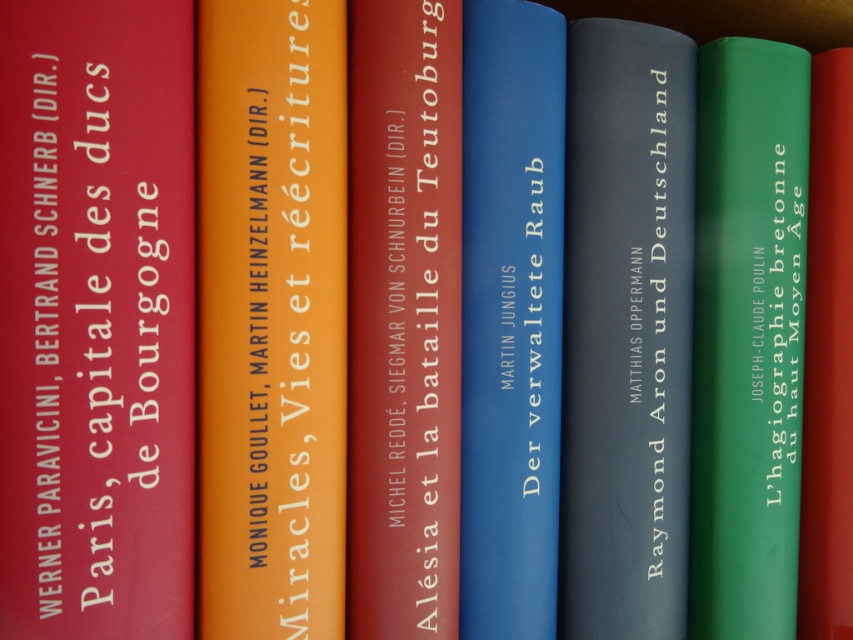
Does point (318, 241) lie behind point (828, 321)?

No, it is not.

Measure the distance between orange matte book at center and camera.

orange matte book at center is 21.85 inches from camera.

Where is `orange matte book at center`? orange matte book at center is located at coordinates click(271, 317).

In the scene shown: Is matte red book at left to the right of matte red book at center from the viewer's perspective?

No, matte red book at left is not to the right of matte red book at center.

The image size is (853, 640). What do you see at coordinates (96, 317) in the screenshot?
I see `matte red book at left` at bounding box center [96, 317].

Locate an element on the screen. matte red book at left is located at coordinates (96, 317).

Does matte red book at left appear under blue hardcover book at center?

Actually, matte red book at left is above blue hardcover book at center.

Is point (155, 81) positioned before point (469, 321)?

That is True.

The width and height of the screenshot is (853, 640). In order to click on matte red book at left in this screenshot , I will do `click(96, 317)`.